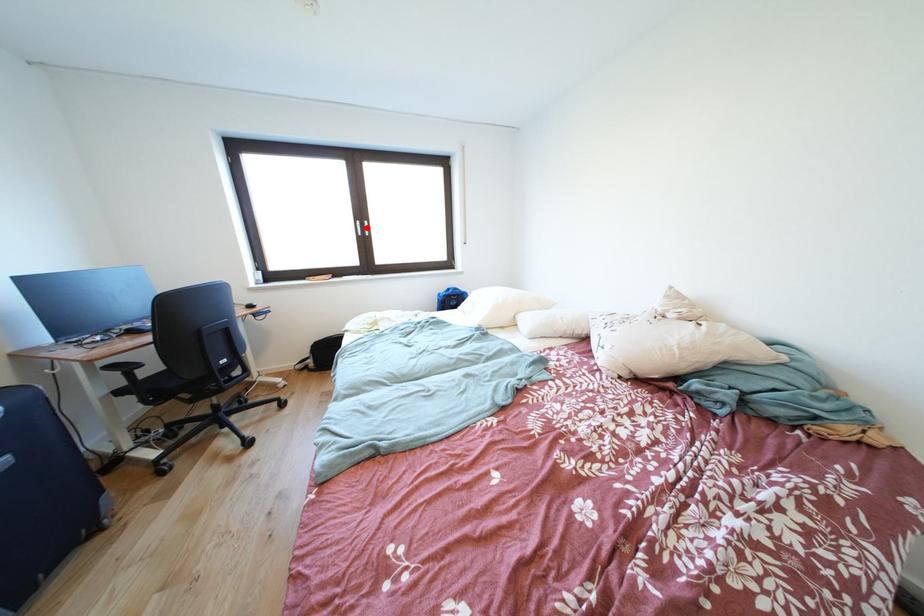
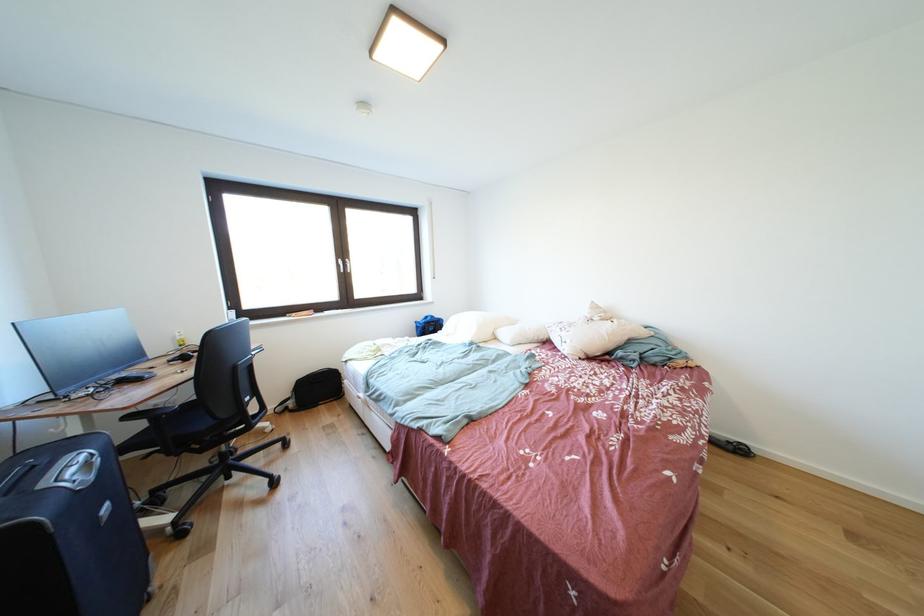
Question: A red point is marked in image1. In image2, is the corresponding 3D point closer to the camera or farther? Reply with the corresponding letter.

Choices:
 (A) The corresponding 3D point is closer.
 (B) The corresponding 3D point is farther.

Answer: (B)